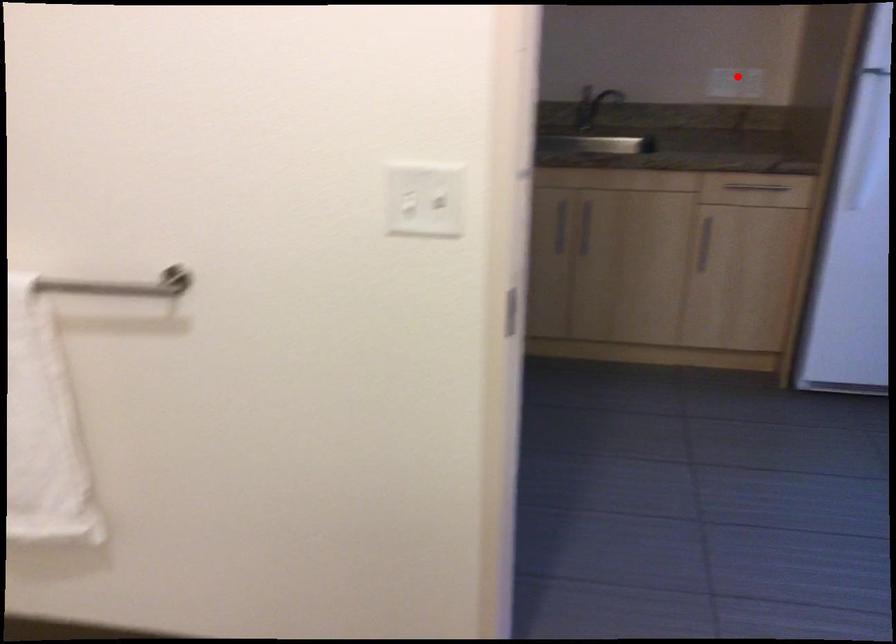
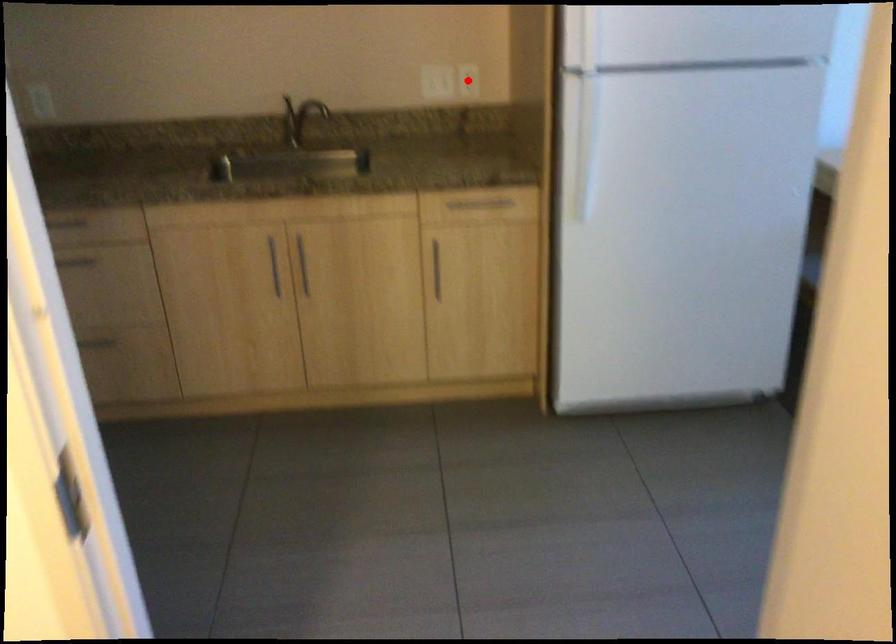
I am providing you with two images of the same scene from different viewpoints. A red point is marked on the first image and another point is marked on the second image. Is the red point in image1 aligned with the point shown in image2?

Yes